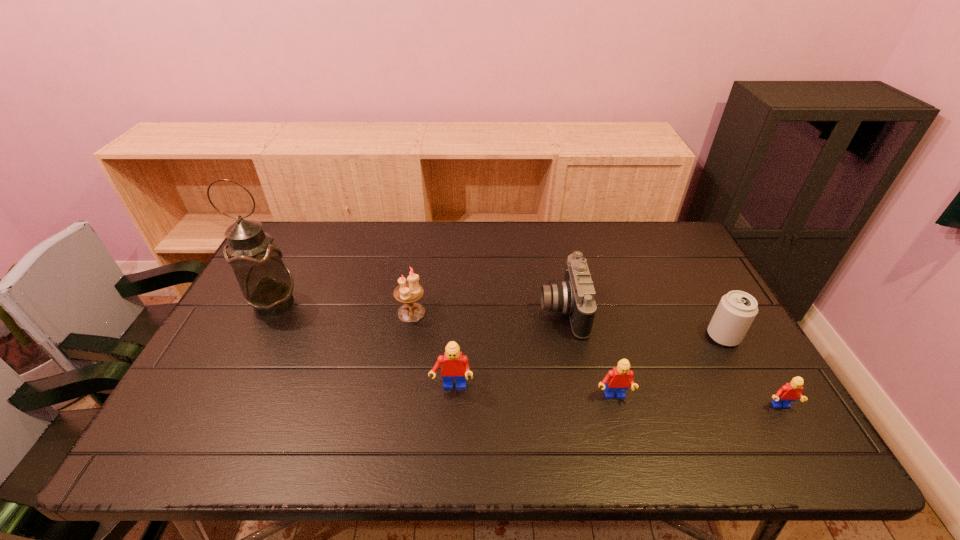
Select which Lego is the second closest to the camera. Please provide its 2D coordinates. Your answer should be formatted as a tuple, i.e. [(x, y)], where the tuple contains the x and y coordinates of a point satisfying the conditions above.

[(455, 365)]

This screenshot has width=960, height=540. Identify the location of free space in the image that satisfies the following two spatial constraints: 1. on the front-facing side of the camera; 2. on the front-facing side of the tallest Lego. (578, 388).

Identify the location of vacant area in the image that satisfies the following two spatial constraints: 1. on the front-facing side of the camera; 2. on the left side of the can. This screenshot has height=540, width=960. (567, 336).